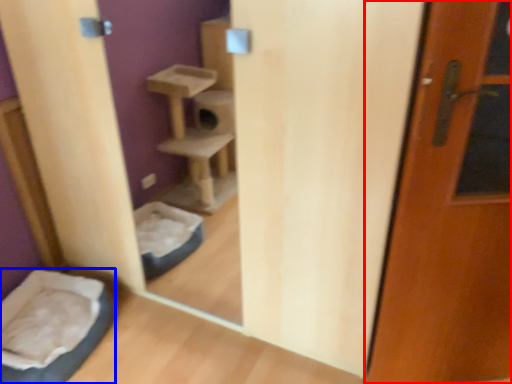
Question: Which of the following is the farthest to the observer, door (highlighted by a red box) or wide (highlighted by a blue box)?

Choices:
 (A) door
 (B) wide

Answer: (B)